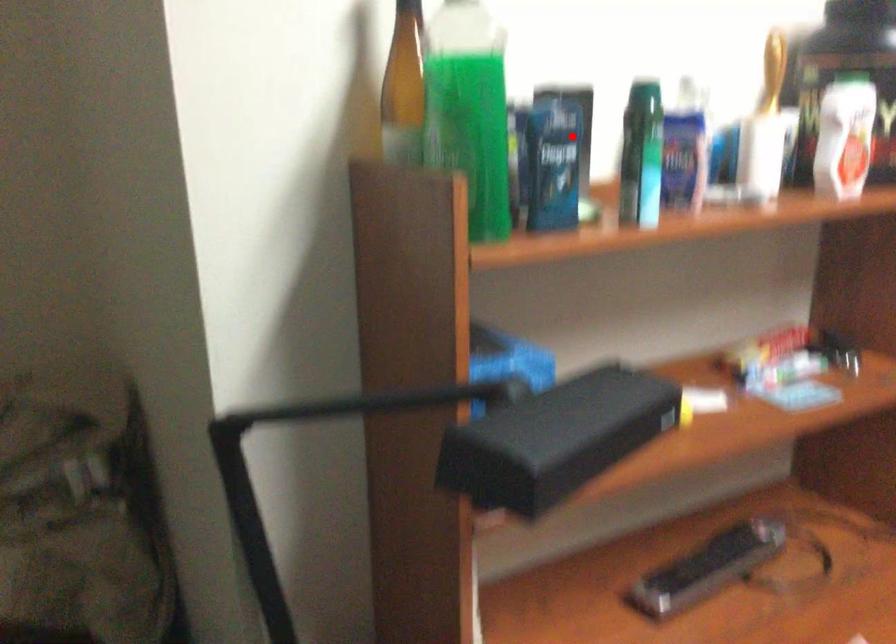
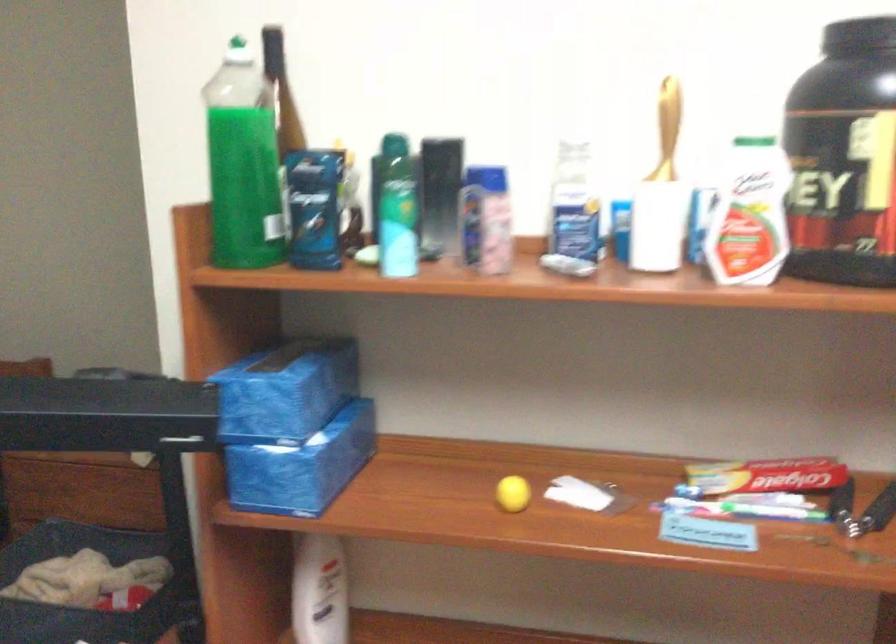
Question: I am providing you with two images of the same scene from different viewpoints. A red point is shown in image1. For the corresponding object point in image2, is it positioned nearer or farther from the camera?

Choices:
 (A) Nearer
 (B) Farther

Answer: (B)